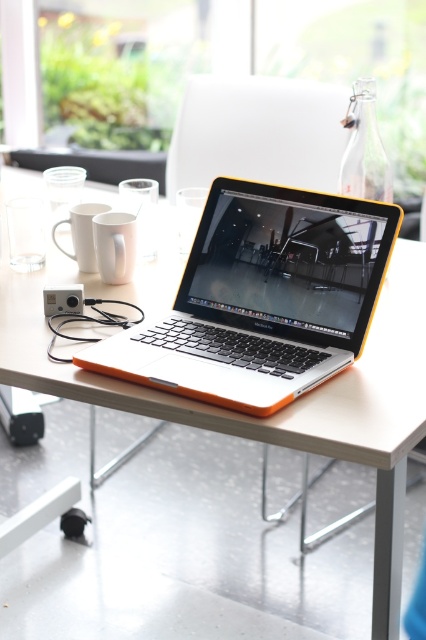
You are a person who wants to place a new book on the table. Given that the white matte table at center is much taller than the orange plastic laptop at center, will the book be above or below the laptop when placed on the table?

The white matte table at center is much taller than the orange plastic laptop at center. When placing the book on the table, the book will be above the laptop since the table is elevated higher than the laptop.

You are a delivery person who needs to place a small package on the table in the image. The package must be placed at the point marked by the coordinates point (245, 416). Can you confirm if this point is on the white matte table at center?

Yes, the point (245, 416) is on the white matte table at center, so you can safely place the package there.

You are sitting at the workspace and want to grab the white matte mug at upper left. Based on their positions, will you need to reach over the white matte table at center to get it?

The white matte table at center is closer to the viewer than the white matte mug at upper left, so you would need to reach over the white matte table at center to grab the white matte mug at upper left.